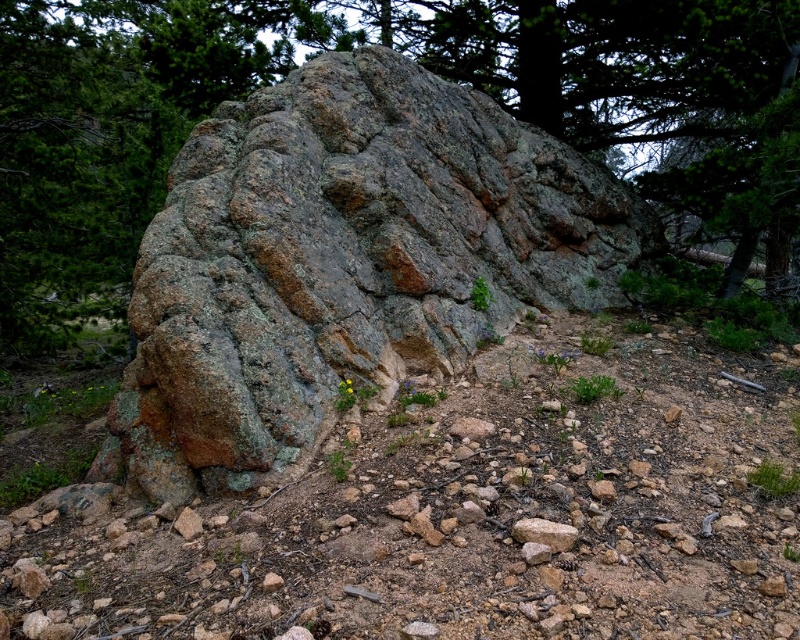
You are standing at the point marked by the coordinates [344,262] in the scene. Based on the description, what object are you most likely standing on?

The point at coordinates [344,262] indicates that you are standing on the rusty granite boulder at center.

You are a geologist examining the rock formations in the scene. You need to determine which object is taller between the rusty granite boulder at center and the gray rough stone at center. Based on the scene description, which one is taller?

The rusty granite boulder at center is much taller than the gray rough stone at center.